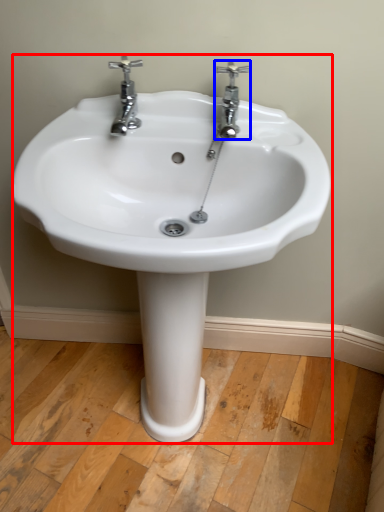
Question: Which object is closer to the camera taking this photo, sink (highlighted by a red box) or tap (highlighted by a blue box)?

Choices:
 (A) sink
 (B) tap

Answer: (A)